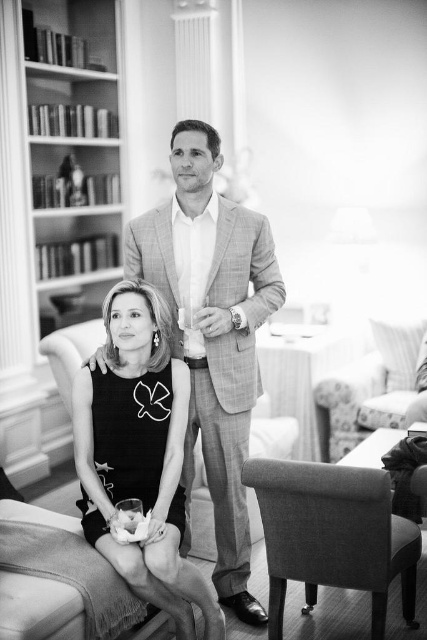
In the scene shown: You are a photographer setting up a shoot in this room. You need to place a 24 inch wide tripod between the matte black dress at center and the soft fabric armchair at lower right. Can you fit it there?

The distance between the matte black dress at center and the soft fabric armchair at lower right is 23.95 inches, so the 24 inch wide tripod cannot fit as it requires more space than available.

You are a photographer trying to adjust the focus of your camera. You have two points in the image that need to be in focus. The first is point at point (181,440) and the second is point at point (79,189). Which point should you focus on first to ensure both are in focus?

You should focus on point (181,440) first because it is closer to the camera than point (79,189). This way, adjusting the focus from the closer point outward will help both points come into focus.